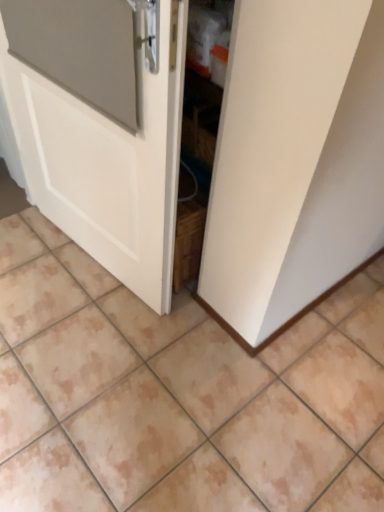
Locate an element on the screen. free space underneath white matte door at center (from a real-world perspective) is located at coordinates (97, 268).